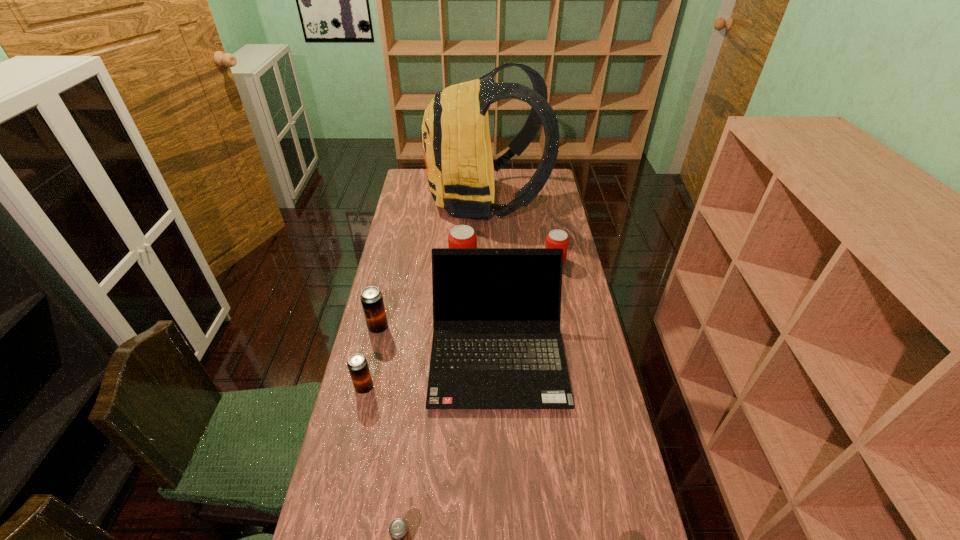
Locate an element on the screen. The height and width of the screenshot is (540, 960). object that is the fifth closest to the second smallest black beer can is located at coordinates (460, 168).

The width and height of the screenshot is (960, 540). What are the coordinates of `object that is the fourth closest to the laptop computer` in the screenshot? It's located at (556, 238).

Find the location of a particular element. beer can that stands as the second closest to the nearest beer can is located at coordinates (371, 297).

Find the location of a particular element. the fourth closest beer can to the sixth shortest object is located at coordinates (556, 238).

Locate which red beer can ranks in proximity to the biggest black beer can. Please provide its 2D coordinates. Your answer should be formatted as a tuple, i.e. [(x, y)], where the tuple contains the x and y coordinates of a point satisfying the conditions above.

[(462, 236)]

In order to click on the closest red beer can relative to the second nearest beer can in this screenshot , I will do click(x=462, y=236).

Select which black beer can is the second closest to the biggest black beer can. Please provide its 2D coordinates. Your answer should be formatted as a tuple, i.e. [(x, y)], where the tuple contains the x and y coordinates of a point satisfying the conditions above.

[(399, 532)]

At what (x,y) coordinates should I click in order to perform the action: click on black beer can identified as the third closest to the rightmost beer can. Please return your answer as a coordinate pair (x, y). This screenshot has width=960, height=540. Looking at the image, I should click on (399, 532).

You are a GUI agent. You are given a task and a screenshot of the screen. Output one action in this format:
    pyautogui.click(x=<x>, y=<y>)
    Task: Click on the vacant space that satisfies the following two spatial constraints: 1. on the back side of the smaller red beer can; 2. on the front-facing side of the tallest object
    Image resolution: width=960 pixels, height=540 pixels.
    Given the screenshot: What is the action you would take?
    pyautogui.click(x=542, y=200)